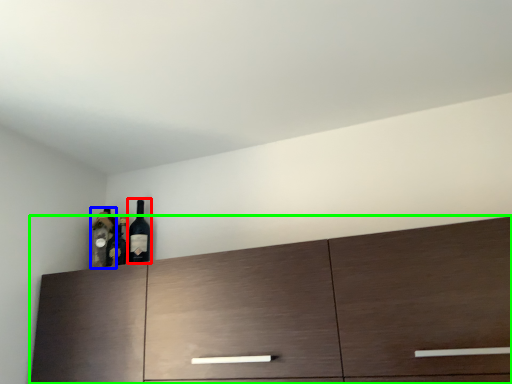
Question: Based on their relative distances, which object is farther from wine bottle (highlighted by a red box)? Choose from bottle (highlighted by a blue box) and cabinetry (highlighted by a green box).

Choices:
 (A) bottle
 (B) cabinetry

Answer: (B)